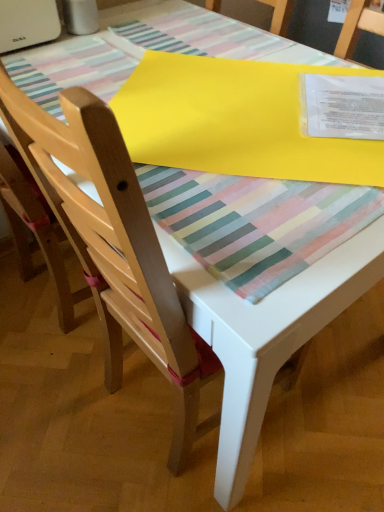
Question: Is the position of matte wood chair at center, which is the first chair in right-to-left order, more distant than that of light wood chair at left, which is counted as the second chair, starting from the right?

Choices:
 (A) yes
 (B) no

Answer: (B)

Question: Is matte wood chair at center, which is the first chair in right-to-left order, positioned with its back to light wood chair at left, which is counted as the first chair, starting from the left?

Choices:
 (A) no
 (B) yes

Answer: (B)

Question: Is matte wood chair at center, which is the first chair in right-to-left order, bigger than light wood chair at left, which is counted as the second chair, starting from the right?

Choices:
 (A) no
 (B) yes

Answer: (B)

Question: Would you say matte wood chair at center, which is the first chair in right-to-left order, is outside light wood chair at left, which is counted as the second chair, starting from the right?

Choices:
 (A) no
 (B) yes

Answer: (B)

Question: Can you confirm if matte wood chair at center, the second chair in the left-to-right sequence, is shorter than light wood chair at left, which is counted as the first chair, starting from the left?

Choices:
 (A) yes
 (B) no

Answer: (A)

Question: Would you say light wood chair at left, which is counted as the second chair, starting from the right, is inside or outside yellow matte paper at upper center?

Choices:
 (A) outside
 (B) inside

Answer: (A)

Question: Based on their positions, is light wood chair at left, which is counted as the first chair, starting from the left, located to the left or right of yellow matte paper at upper center?

Choices:
 (A) right
 (B) left

Answer: (B)

Question: Is light wood chair at left, which is counted as the second chair, starting from the right, wider or thinner than yellow matte paper at upper center?

Choices:
 (A) thin
 (B) wide

Answer: (A)

Question: Based on their sizes in the image, would you say light wood chair at left, which is counted as the second chair, starting from the right, is bigger or smaller than yellow matte paper at upper center?

Choices:
 (A) small
 (B) big

Answer: (B)

Question: Is matte wood chair at center, the second chair in the left-to-right sequence, situated inside light wood chair at left, which is counted as the first chair, starting from the left, or outside?

Choices:
 (A) inside
 (B) outside

Answer: (B)

Question: From their relative heights in the image, would you say matte wood chair at center, the second chair in the left-to-right sequence, is taller or shorter than light wood chair at left, which is counted as the second chair, starting from the right?

Choices:
 (A) tall
 (B) short

Answer: (B)

Question: From a real-world perspective, relative to light wood chair at left, which is counted as the second chair, starting from the right, is matte wood chair at center, the second chair in the left-to-right sequence, vertically above or below?

Choices:
 (A) below
 (B) above

Answer: (A)

Question: From the image's perspective, is matte wood chair at center, the second chair in the left-to-right sequence, located above or below light wood chair at left, which is counted as the second chair, starting from the right?

Choices:
 (A) below
 (B) above

Answer: (A)

Question: From the image's perspective, relative to light wood chair at left, which is counted as the first chair, starting from the left, is yellow matte paper at upper center above or below?

Choices:
 (A) above
 (B) below

Answer: (A)

Question: Based on their positions, is yellow matte paper at upper center located to the left or right of light wood chair at left, which is counted as the second chair, starting from the right?

Choices:
 (A) right
 (B) left

Answer: (A)